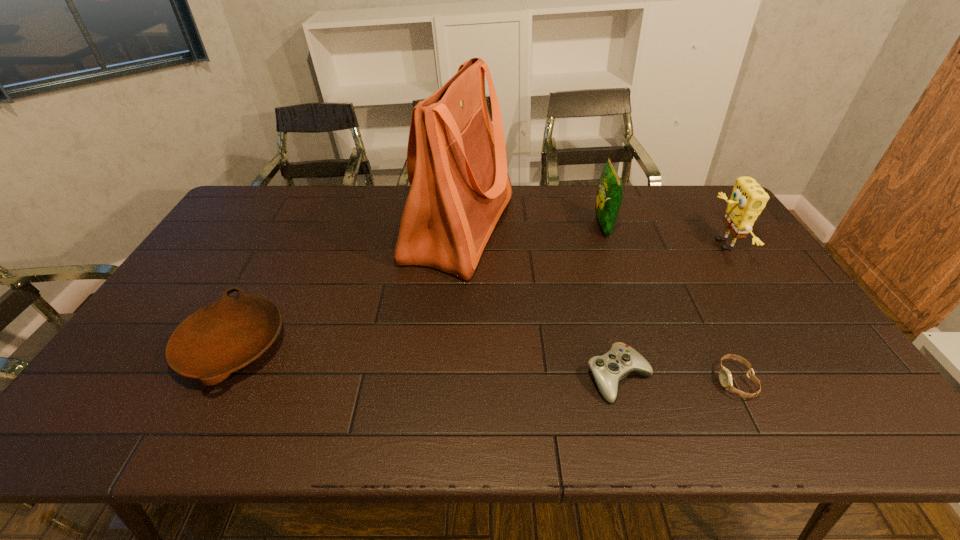
Locate an element on the screen. The image size is (960, 540). free area in between the crisp (potato chip) and the sponge is located at coordinates (662, 235).

You are a GUI agent. You are given a task and a screenshot of the screen. Output one action in this format:
    pyautogui.click(x=<x>, y=<y>)
    Task: Click on the unoccupied area between the control and the sponge
    This screenshot has width=960, height=540.
    Given the screenshot: What is the action you would take?
    pyautogui.click(x=671, y=311)

In order to click on vacant area that lies between the leftmost object and the second object from right to left in this screenshot , I will do `click(484, 364)`.

Locate an element on the screen. The image size is (960, 540). vacant area between the control and the crisp (potato chip) is located at coordinates (611, 302).

Identify the location of the fifth closest object relative to the sponge. This screenshot has width=960, height=540. (220, 338).

Where is `object that is the second closest to the control`? Image resolution: width=960 pixels, height=540 pixels. object that is the second closest to the control is located at coordinates (456, 159).

The width and height of the screenshot is (960, 540). What are the coordinates of `free region that satisfies the following two spatial constraints: 1. on the front-facing side of the crisp (potato chip); 2. on the front side of the leftmost object` in the screenshot? It's located at (645, 347).